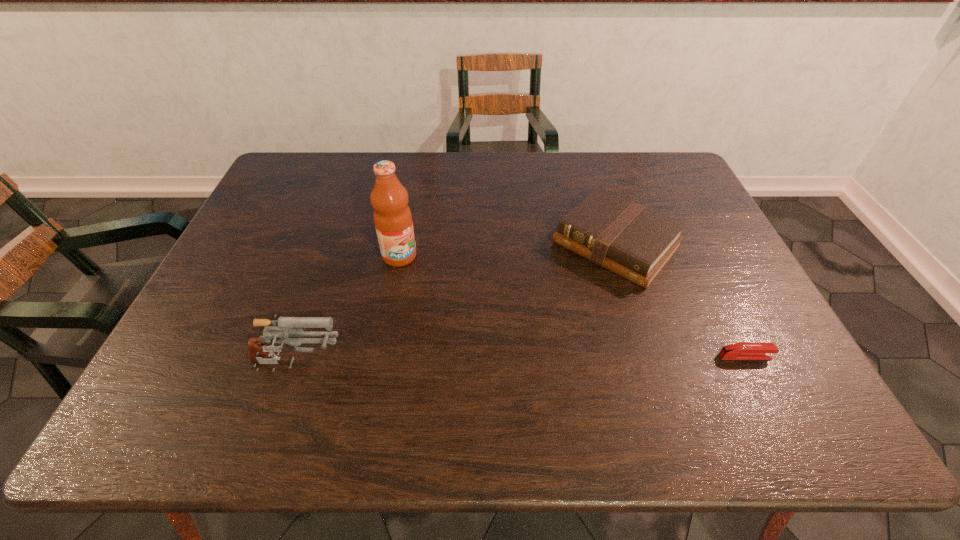
Find the location of a particular element. Image resolution: width=960 pixels, height=540 pixels. free space at the left edge of the desktop is located at coordinates (275, 251).

Find the location of a particular element. vacant space at the right edge is located at coordinates (725, 344).

Identify the location of vacant area at the far left corner. This screenshot has height=540, width=960. (327, 168).

Where is `free location at the far right corner`? Image resolution: width=960 pixels, height=540 pixels. free location at the far right corner is located at coordinates (650, 161).

At what (x,y) coordinates should I click in order to perform the action: click on free space between the tallest object and the second shortest object. Please return your answer as a coordinate pair (x, y). The image size is (960, 540). Looking at the image, I should click on click(x=508, y=250).

I want to click on free space between the gun and the third tallest object, so click(x=456, y=306).

Locate an element on the screen. free space between the third object from right to left and the Bible is located at coordinates (508, 250).

Where is `free point between the leftmost object and the second object from left to right`? The height and width of the screenshot is (540, 960). free point between the leftmost object and the second object from left to right is located at coordinates tap(348, 312).

I want to click on free space between the fruit juice and the Bible, so click(508, 250).

Find the location of `free space between the stapler and the second tallest object`. free space between the stapler and the second tallest object is located at coordinates (521, 362).